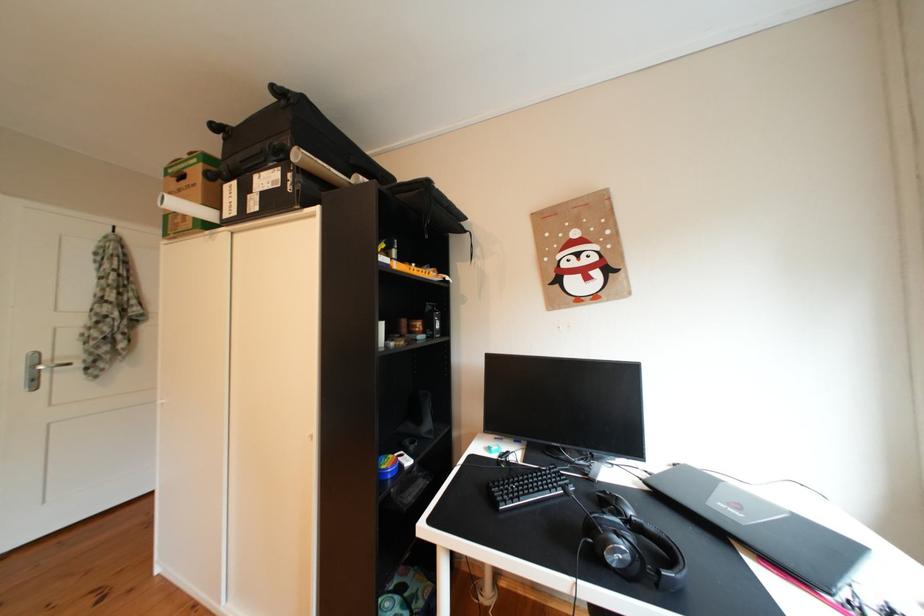
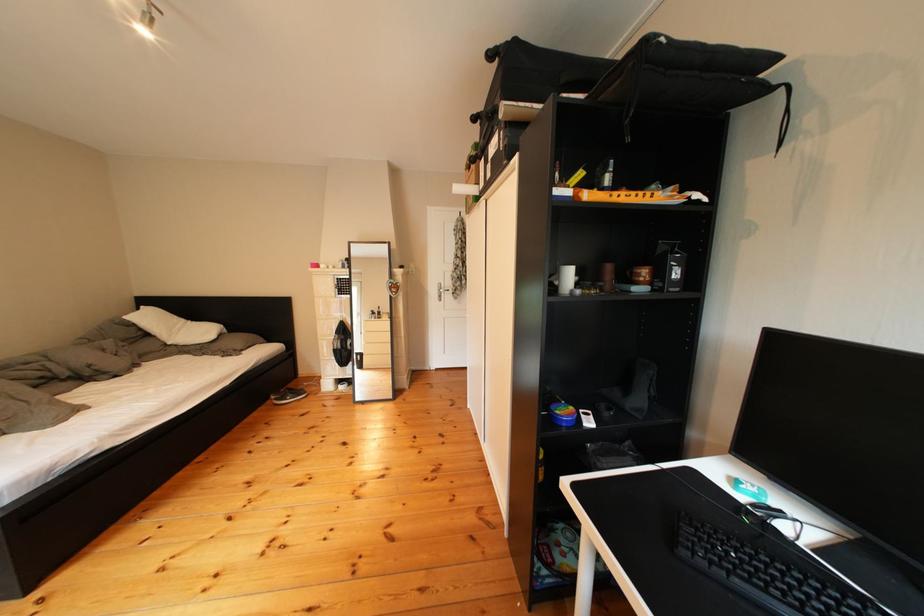
Locate, in the second image, the point that corresponds to (x=405, y=461) in the first image.

(586, 413)